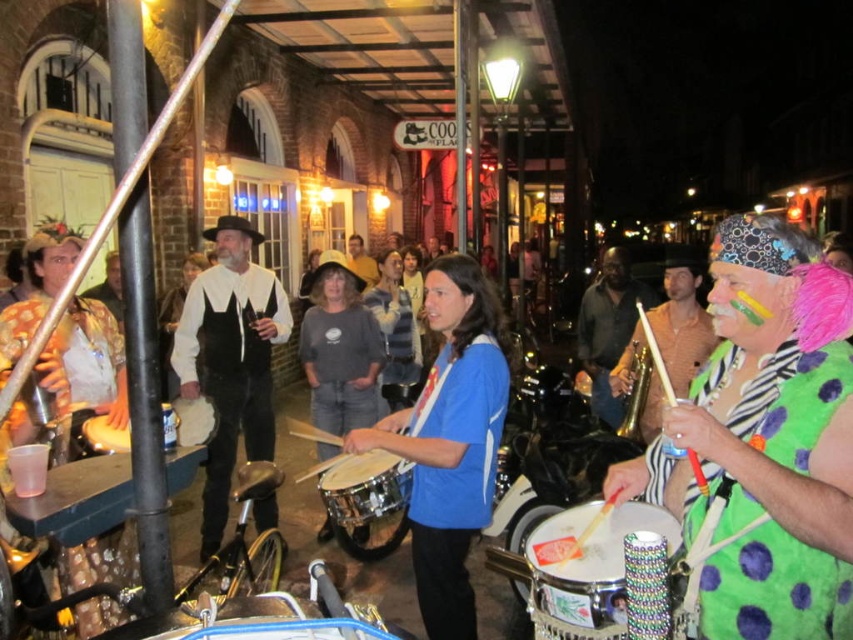
You are standing on the cobblestone street and see the green polka dot shirt at center and the blue fabric shirt at center. Which one is positioned more to the left?

The blue fabric shirt at center is positioned more to the left because the green polka dot shirt at center is to the right of it.